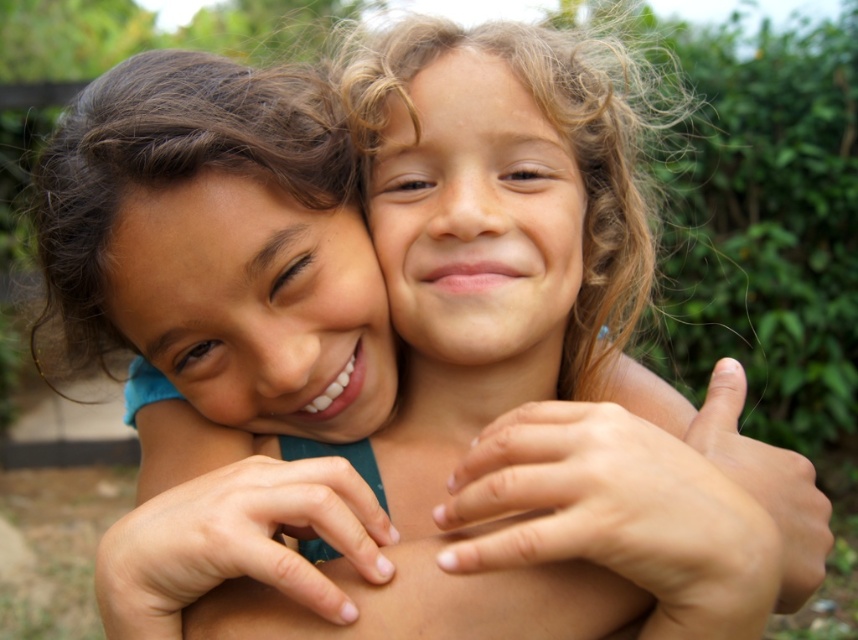
Find the location of `smooth skin face at center`. smooth skin face at center is located at coordinates (254, 305).

Does point (203, 397) come closer to viewer compared to point (512, 285)?

No, it is not.

Identify the location of smooth skin face at center. (254, 305).